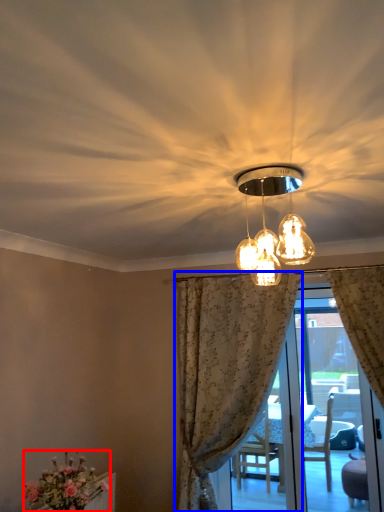
Question: Which object is closer to the camera taking this photo, flower (highlighted by a red box) or curtain (highlighted by a blue box)?

Choices:
 (A) flower
 (B) curtain

Answer: (A)